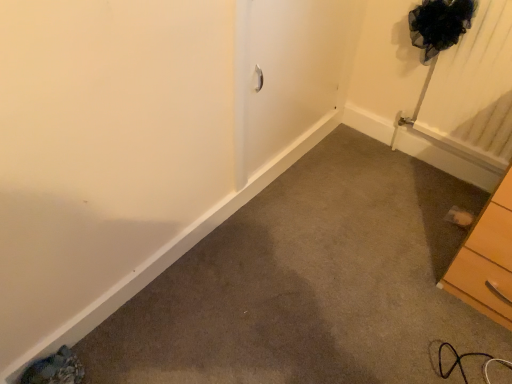
Describe the element at coordinates (287, 73) in the screenshot. I see `silver metallic screen door at center` at that location.

This screenshot has width=512, height=384. I want to click on silver metallic screen door at center, so click(287, 73).

Where is `wooden chest of drawers at lower right`? wooden chest of drawers at lower right is located at coordinates (487, 259).

Image resolution: width=512 pixels, height=384 pixels. Describe the element at coordinates (487, 259) in the screenshot. I see `wooden chest of drawers at lower right` at that location.

Locate an element on the screen. The width and height of the screenshot is (512, 384). silver metallic screen door at center is located at coordinates (287, 73).

Is wooden chest of drawers at lower right to the left or to the right of silver metallic screen door at center in the image?

Based on their positions, wooden chest of drawers at lower right is located to the right of silver metallic screen door at center.

Is wooden chest of drawers at lower right further to camera compared to silver metallic screen door at center?

That is False.

Which point is more distant from viewer, (496, 261) or (283, 57)?

The point (283, 57) is behind.

From the image's perspective, does wooden chest of drawers at lower right appear lower than silver metallic screen door at center?

Yes, from the image's perspective, wooden chest of drawers at lower right is below silver metallic screen door at center.

From a real-world perspective, is wooden chest of drawers at lower right positioned over silver metallic screen door at center based on gravity?

No, from a real-world perspective, wooden chest of drawers at lower right is not over silver metallic screen door at center

Considering the sizes of wooden chest of drawers at lower right and silver metallic screen door at center in the image, is wooden chest of drawers at lower right wider or thinner than silver metallic screen door at center?

Considering their sizes, wooden chest of drawers at lower right looks broader than silver metallic screen door at center.

Considering the relative sizes of wooden chest of drawers at lower right and silver metallic screen door at center in the image provided, is wooden chest of drawers at lower right taller than silver metallic screen door at center?

In fact, wooden chest of drawers at lower right may be shorter than silver metallic screen door at center.

Who is smaller, wooden chest of drawers at lower right or silver metallic screen door at center?

silver metallic screen door at center is smaller.

Do you think wooden chest of drawers at lower right is within silver metallic screen door at center, or outside of it?

wooden chest of drawers at lower right is not enclosed by silver metallic screen door at center.

Is wooden chest of drawers at lower right not near silver metallic screen door at center?

No, wooden chest of drawers at lower right is not far away from silver metallic screen door at center.

From the picture: Is wooden chest of drawers at lower right positioned with its back to silver metallic screen door at center?

No, silver metallic screen door at center is not at the back of wooden chest of drawers at lower right.

You are a GUI agent. You are given a task and a screenshot of the screen. Output one action in this format:
    pyautogui.click(x=<x>, y=<y>)
    Task: Click on the chest of drawers lying on the right of silver metallic screen door at center
    The width and height of the screenshot is (512, 384).
    Given the screenshot: What is the action you would take?
    pyautogui.click(x=487, y=259)

Is silver metallic screen door at center to the left of wooden chest of drawers at lower right from the viewer's perspective?

Correct, you'll find silver metallic screen door at center to the left of wooden chest of drawers at lower right.

Which object is more forward, silver metallic screen door at center or wooden chest of drawers at lower right?

wooden chest of drawers at lower right is in front.

Is point (261, 15) positioned after point (501, 189)?

That is True.

From the image's perspective, is silver metallic screen door at center on wooden chest of drawers at lower right?

Yes, from the image's perspective, silver metallic screen door at center is over wooden chest of drawers at lower right.

From a real-world perspective, which object stands above the other?

silver metallic screen door at center is physically above.

Looking at this image, which object is wider, silver metallic screen door at center or wooden chest of drawers at lower right?

wooden chest of drawers at lower right is wider.

Who is shorter, silver metallic screen door at center or wooden chest of drawers at lower right?

Standing shorter between the two is wooden chest of drawers at lower right.

Who is smaller, silver metallic screen door at center or wooden chest of drawers at lower right?

silver metallic screen door at center is smaller.

In the scene shown: Is wooden chest of drawers at lower right completely or partially inside silver metallic screen door at center?

No, wooden chest of drawers at lower right is not inside silver metallic screen door at center.

Is there a large distance between silver metallic screen door at center and wooden chest of drawers at lower right?

Actually, silver metallic screen door at center and wooden chest of drawers at lower right are a little close together.

Is wooden chest of drawers at lower right at the back of silver metallic screen door at center?

No, silver metallic screen door at center is not facing away from wooden chest of drawers at lower right.

Can you tell me how much silver metallic screen door at center and wooden chest of drawers at lower right differ in facing direction?

91.3 degrees separate the facing orientations of silver metallic screen door at center and wooden chest of drawers at lower right.

This screenshot has width=512, height=384. Identify the location of chest of drawers to the right of silver metallic screen door at center. (487, 259).

Locate an element on the screen. screen door that is above the wooden chest of drawers at lower right (from a real-world perspective) is located at coordinates (287, 73).

The width and height of the screenshot is (512, 384). In order to click on chest of drawers on the right of silver metallic screen door at center in this screenshot , I will do `click(487, 259)`.